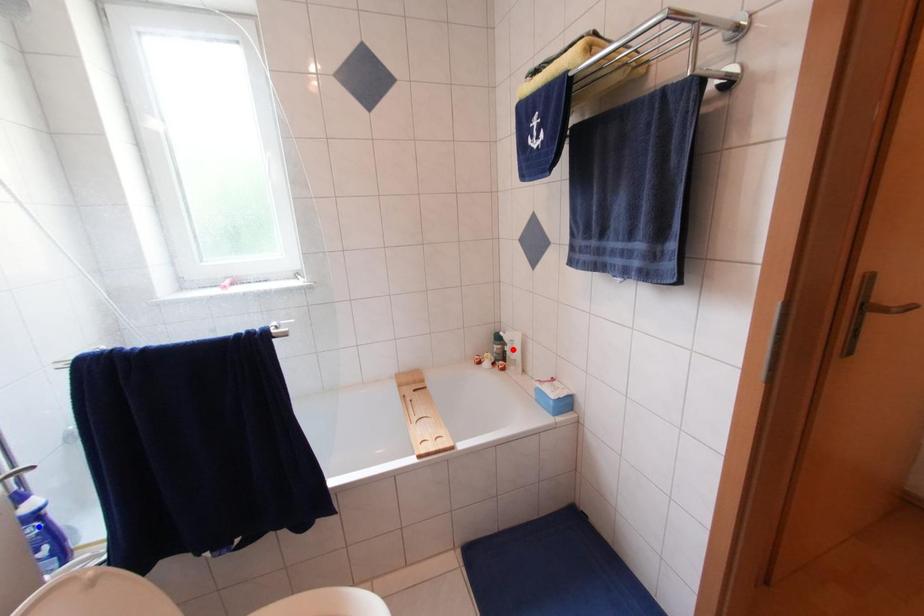
Question: Which of the two points in the image is closer to the camera?

Choices:
 (A) Blue point is closer.
 (B) Red point is closer.

Answer: (A)